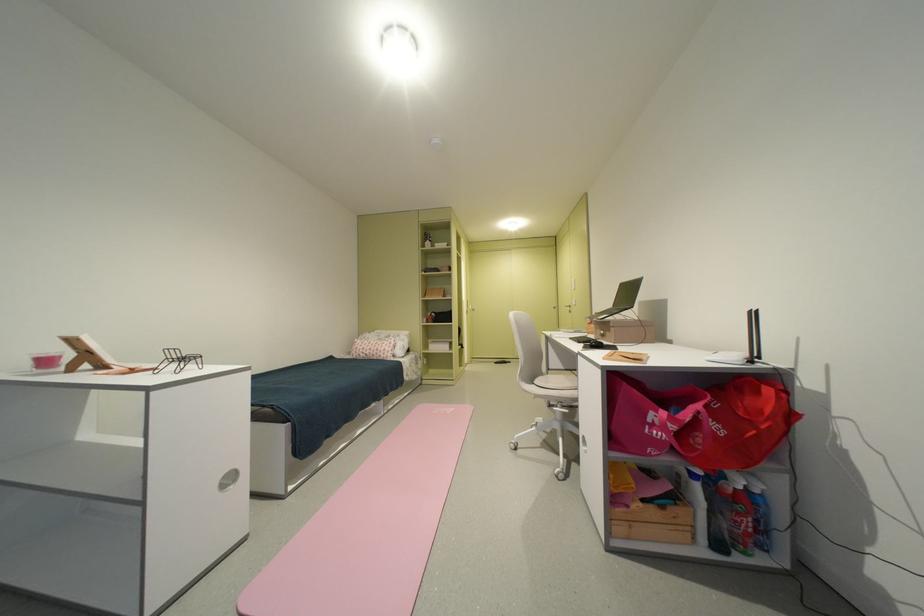
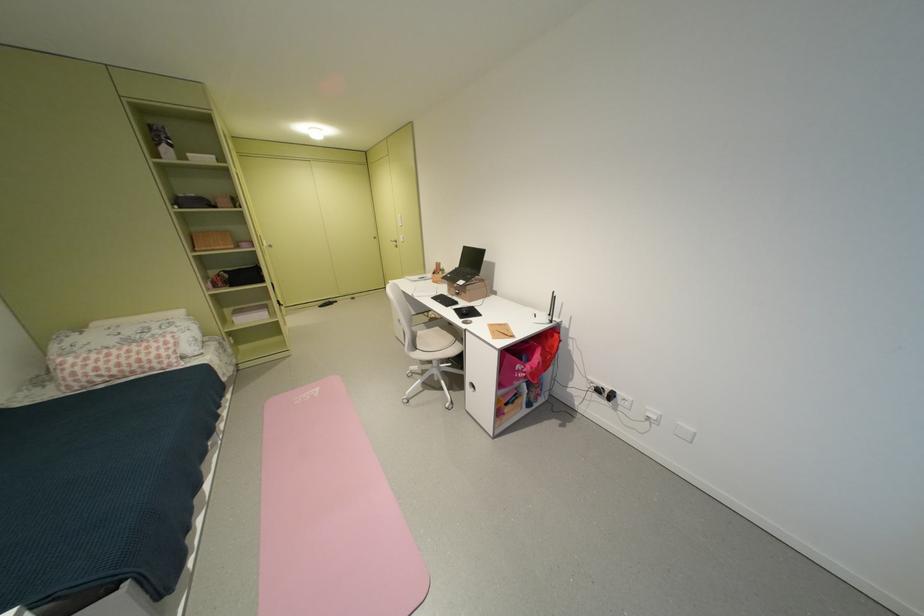
Where in the second image is the point corresponding to [444,413] from the first image?

(305, 403)